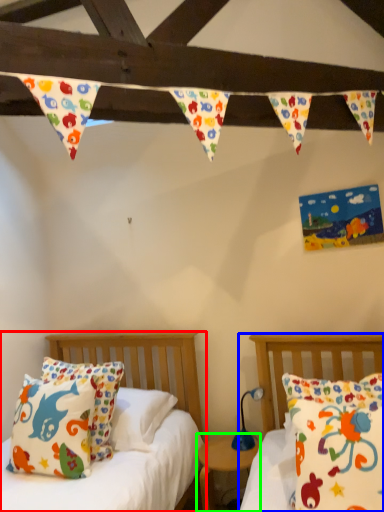
Question: Estimate the real-world distances between objects in this image. Which object is farther from bed (highlighted by a red box), bed (highlighted by a blue box) or nightstand (highlighted by a green box)?

Choices:
 (A) bed
 (B) nightstand

Answer: (A)